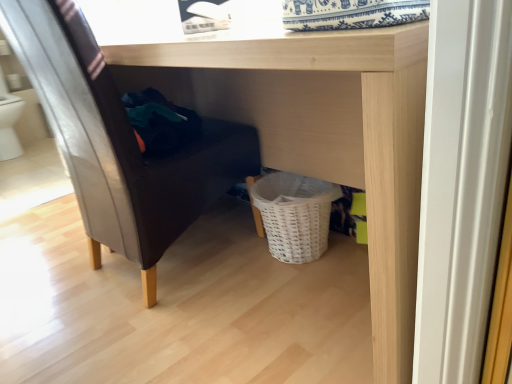
Locate an element on the screen. Image resolution: width=512 pixels, height=384 pixels. matte black chair at left is located at coordinates (119, 142).

What do you see at coordinates (119, 142) in the screenshot?
I see `matte black chair at left` at bounding box center [119, 142].

What do you see at coordinates (323, 134) in the screenshot? I see `wooden table at center` at bounding box center [323, 134].

The height and width of the screenshot is (384, 512). Find the location of `wooden table at center`. wooden table at center is located at coordinates (323, 134).

Image resolution: width=512 pixels, height=384 pixels. In order to click on matte black chair at left in this screenshot , I will do `click(119, 142)`.

Can you confirm if matte black chair at left is positioned to the right of wooden table at center?

Incorrect, matte black chair at left is not on the right side of wooden table at center.

Does matte black chair at left come behind wooden table at center?

Yes.

Which point is more distant from viewer, (x=165, y=236) or (x=413, y=254)?

The point (x=165, y=236) is more distant.

From the image's perspective, who appears lower, matte black chair at left or wooden table at center?

wooden table at center is shown below in the image.

From a real-world perspective, who is located higher, matte black chair at left or wooden table at center?

From a 3D spatial view, matte black chair at left is above.

Considering the sizes of objects matte black chair at left and wooden table at center in the image provided, who is thinner, matte black chair at left or wooden table at center?

matte black chair at left.

Is matte black chair at left shorter than wooden table at center?

No, matte black chair at left is not shorter than wooden table at center.

Does matte black chair at left have a larger size compared to wooden table at center?

Incorrect, matte black chair at left is not larger than wooden table at center.

Which is correct: matte black chair at left is inside wooden table at center, or outside of it?

matte black chair at left is contained in wooden table at center.

Is matte black chair at left placed right next to wooden table at center?

There is a gap between matte black chair at left and wooden table at center.

Is matte black chair at left turned away from wooden table at center?

Yes, wooden table at center is at the back of matte black chair at left.

How many degrees apart are the facing directions of matte black chair at left and wooden table at center?

The angular difference between matte black chair at left and wooden table at center is 179 degrees.

How distant is matte black chair at left from wooden table at center?

They are 38.46 centimeters apart.

The width and height of the screenshot is (512, 384). I want to click on furniture on the left side of wooden table at center, so click(119, 142).

Does wooden table at center appear on the left side of matte black chair at left?

In fact, wooden table at center is to the right of matte black chair at left.

Based on the photo, in the image, is wooden table at center positioned in front of or behind matte black chair at left?

Clearly, wooden table at center is in front of matte black chair at left.

Is point (127, 62) closer or farther from the camera than point (98, 215)?

Point (127, 62).

From the image's perspective, who appears lower, wooden table at center or matte black chair at left?

wooden table at center.

From a real-world perspective, does wooden table at center sit lower than matte black chair at left?

Indeed, from a real-world perspective, wooden table at center is positioned beneath matte black chair at left.

Which object is wider, wooden table at center or matte black chair at left?

Wider between the two is wooden table at center.

Between wooden table at center and matte black chair at left, which one has more height?

With more height is matte black chair at left.

Does wooden table at center have a smaller size compared to matte black chair at left?

Incorrect, wooden table at center is not smaller in size than matte black chair at left.

Is wooden table at center located outside matte black chair at left?

wooden table at center is positioned outside matte black chair at left.

Are wooden table at center and matte black chair at left making contact?

No, wooden table at center is not in contact with matte black chair at left.

Is wooden table at center turned away from matte black chair at left?

Yes, wooden table at center's orientation is away from matte black chair at left.

Find the location of a particular element. This screenshot has height=384, width=512. table below the matte black chair at left (from the image's perspective) is located at coordinates (323, 134).

The image size is (512, 384). What are the coordinates of `table below the matte black chair at left (from the image's perspective)` in the screenshot? It's located at (323, 134).

The image size is (512, 384). What are the coordinates of `furniture that is above the wooden table at center (from the image's perspective)` in the screenshot? It's located at (119, 142).